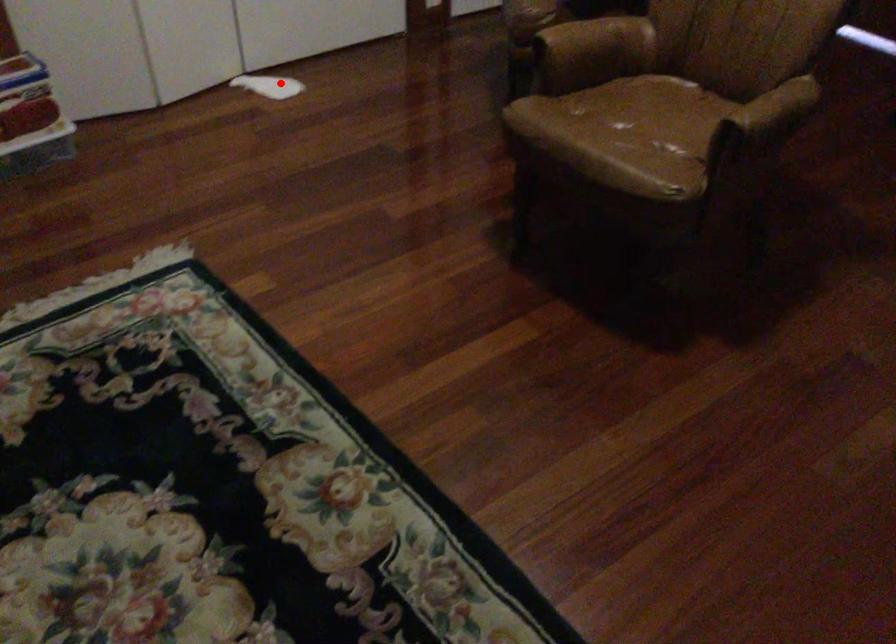
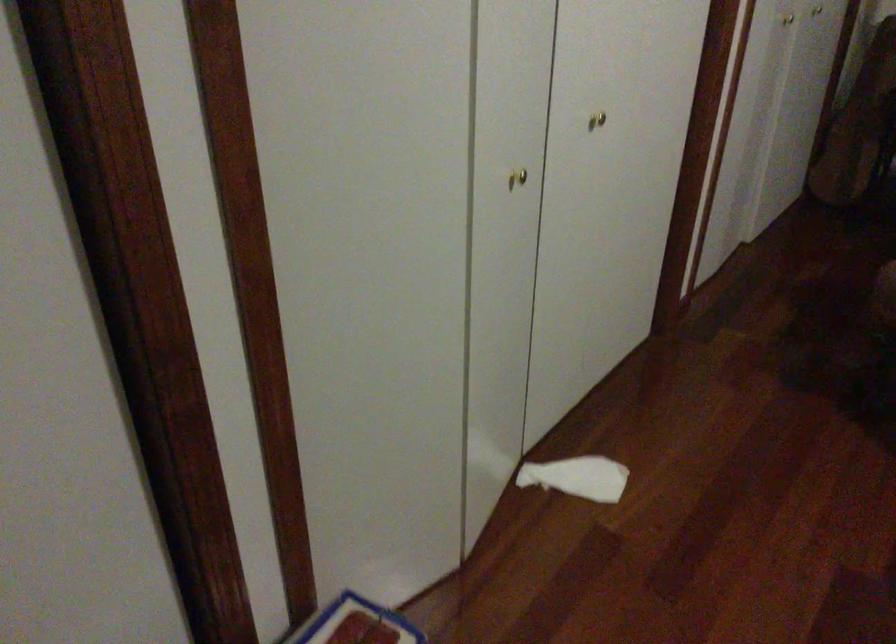
In the second image, find the point that corresponds to the highlighted location in the first image.

(578, 477)